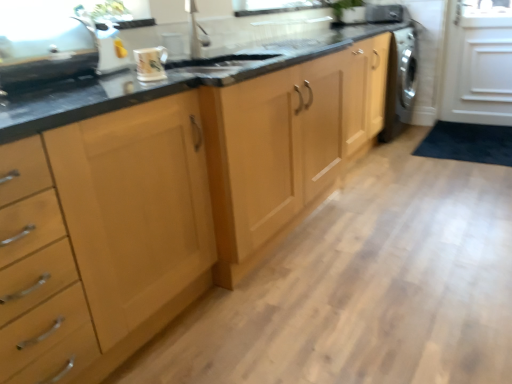
Question: Is metallic silver kettle at upper left, the second appliance viewed from the front, wider than glossy ceramic mug at upper center?

Choices:
 (A) yes
 (B) no

Answer: (A)

Question: Can glossy ceramic mug at upper center be found inside metallic silver kettle at upper left, the second appliance viewed from the front?

Choices:
 (A) no
 (B) yes

Answer: (A)

Question: Does metallic silver kettle at upper left, the second appliance viewed from the right, appear on the left side of glossy ceramic mug at upper center?

Choices:
 (A) yes
 (B) no

Answer: (A)

Question: From a real-world perspective, is metallic silver kettle at upper left, placed as the 2th appliance when sorted from left to right, located higher than glossy ceramic mug at upper center?

Choices:
 (A) yes
 (B) no

Answer: (A)

Question: From a real-world perspective, is metallic silver kettle at upper left, the second appliance viewed from the right, located beneath glossy ceramic mug at upper center?

Choices:
 (A) yes
 (B) no

Answer: (B)

Question: From a real-world perspective, is metallic silver kettle at upper left, placed as the 2th appliance when sorted from left to right, physically located above or below satin silver sink at upper left, placed as the third appliance when sorted from top to bottom?

Choices:
 (A) above
 (B) below

Answer: (A)

Question: Considering the positions of metallic silver kettle at upper left, the 2th appliance in the bottom-to-top sequence, and satin silver sink at upper left, the 1th appliance when ordered from bottom to top, in the image, is metallic silver kettle at upper left, the 2th appliance in the bottom-to-top sequence, taller or shorter than satin silver sink at upper left, the 1th appliance when ordered from bottom to top,?

Choices:
 (A) short
 (B) tall

Answer: (B)

Question: From the image's perspective, is metallic silver kettle at upper left, placed as the 2th appliance when sorted from left to right, located above or below satin silver sink at upper left, placed as the third appliance when sorted from top to bottom?

Choices:
 (A) below
 (B) above

Answer: (B)

Question: In the image, is metallic silver kettle at upper left, which is counted as the 2th appliance, starting from the back, on the left side or the right side of satin silver sink at upper left, which ranks as the first appliance in front-to-back order?

Choices:
 (A) right
 (B) left

Answer: (A)

Question: From a real-world perspective, relative to green leafy plant at upper center, is satin silver dishwasher at right, which ranks as the 1th appliance in right-to-left order, vertically above or below?

Choices:
 (A) above
 (B) below

Answer: (B)

Question: Choose the correct answer: Is satin silver dishwasher at right, which is counted as the 3th appliance, starting from the bottom, inside green leafy plant at upper center or outside it?

Choices:
 (A) outside
 (B) inside

Answer: (A)

Question: Considering the positions of point (399, 6) and point (355, 1), is point (399, 6) closer or farther from the camera than point (355, 1)?

Choices:
 (A) farther
 (B) closer

Answer: (A)

Question: Would you say satin silver dishwasher at right, the 3th appliance viewed from the left, is to the left or to the right of green leafy plant at upper center in the picture?

Choices:
 (A) right
 (B) left

Answer: (A)

Question: Based on their sizes in the image, would you say satin silver dishwasher at right, the 3th appliance viewed from the left, is bigger or smaller than glossy ceramic mug at upper center?

Choices:
 (A) small
 (B) big

Answer: (B)

Question: In terms of height, does satin silver dishwasher at right, which ranks as the 1th appliance in right-to-left order, look taller or shorter compared to glossy ceramic mug at upper center?

Choices:
 (A) tall
 (B) short

Answer: (A)